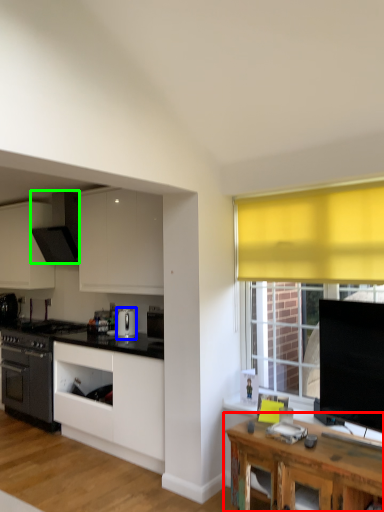
Question: Estimate the real-world distances between objects in this image. Which object is closer to table (highlighted by a red box), kitchen appliance (highlighted by a blue box) or kitchen appliance (highlighted by a green box)?

Choices:
 (A) kitchen appliance
 (B) kitchen appliance

Answer: (A)